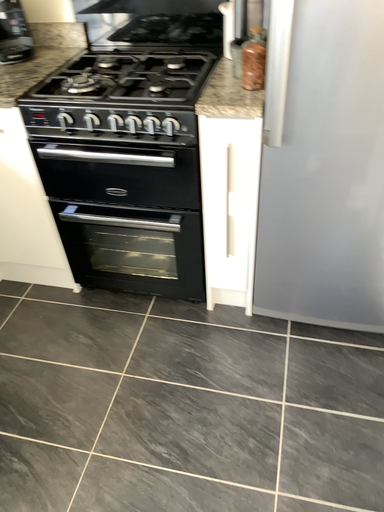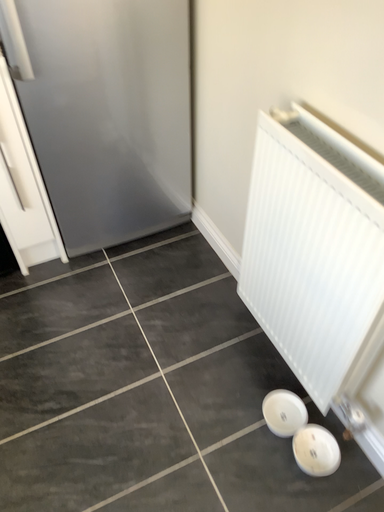
Question: Which way did the camera rotate in the video?

Choices:
 (A) rotated left
 (B) rotated right

Answer: (B)